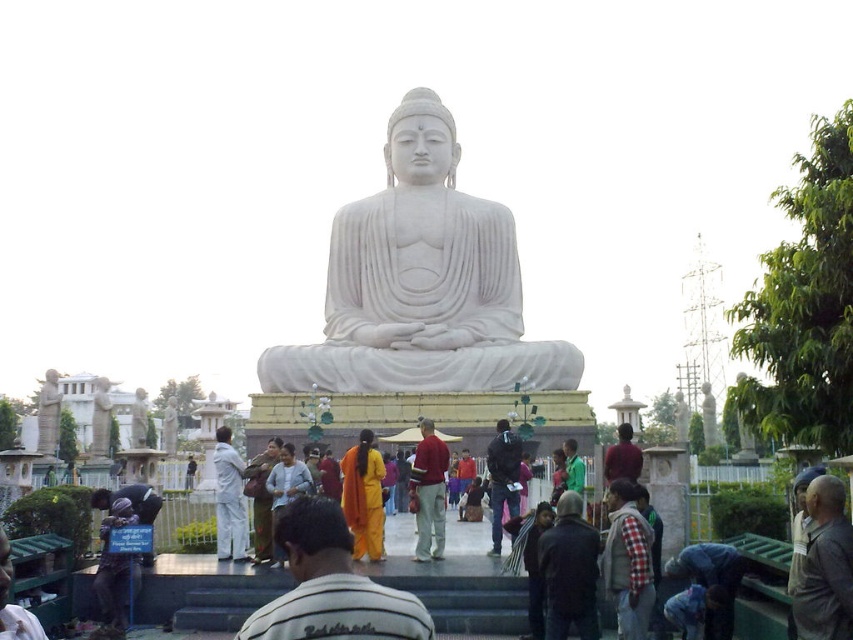
Question: Which point is farther to the camera?

Choices:
 (A) (840, 564)
 (B) (515, 252)
 (C) (291, 637)

Answer: (B)

Question: Is yellow clothed monk at center below brown textured cloth at lower right?

Choices:
 (A) no
 (B) yes

Answer: (B)

Question: Is the position of white marble statue at center more distant than that of brown textured cloth at lower right?

Choices:
 (A) no
 (B) yes

Answer: (B)

Question: Which point is farther to the camera?

Choices:
 (A) (817, 538)
 (B) (315, 620)

Answer: (A)

Question: Which point appears farthest from the camera in this image?

Choices:
 (A) coord(450,211)
 (B) coord(302,522)
 (C) coord(840,486)

Answer: (A)

Question: Does white marble statue at center have a lesser width compared to yellow clothed monk at center?

Choices:
 (A) no
 (B) yes

Answer: (A)